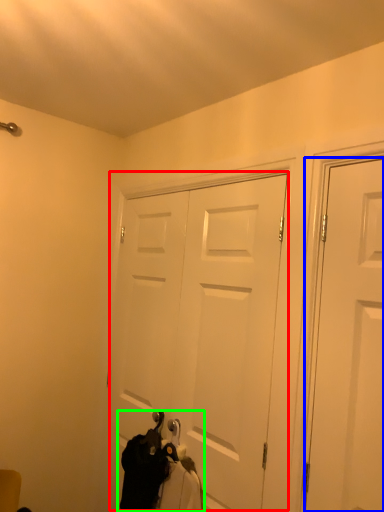
Question: Which is nearer to the door (highlighted by a red box)? door (highlighted by a blue box) or laundry (highlighted by a green box).

Choices:
 (A) door
 (B) laundry

Answer: (B)